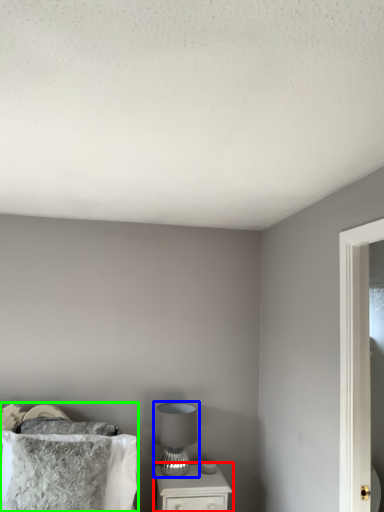
Question: Which object is positioned farthest from nightstand (highlighted by a red box)? Select from table lamp (highlighted by a blue box) and bed (highlighted by a green box).

Choices:
 (A) table lamp
 (B) bed

Answer: (B)